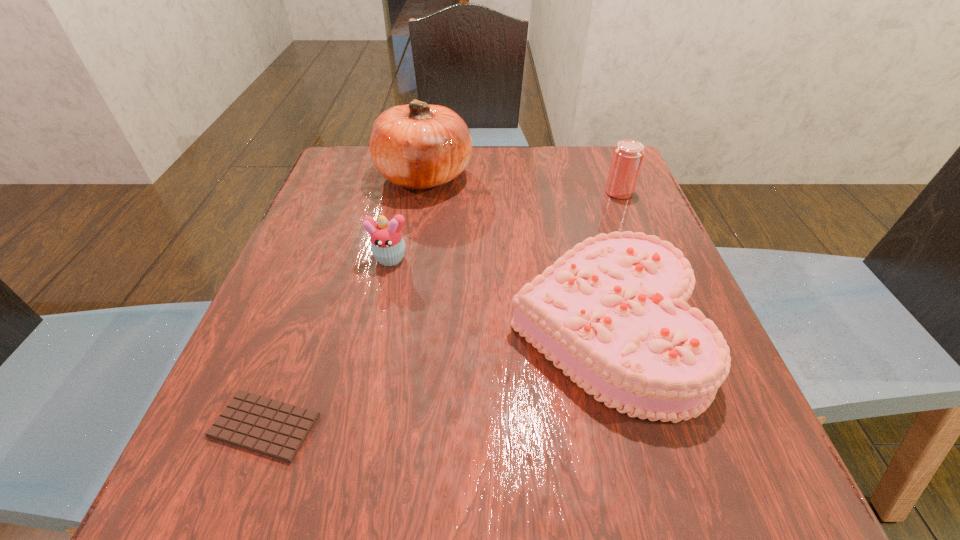
Find the location of a particular element. The width and height of the screenshot is (960, 540). pumpkin that is at the far edge is located at coordinates (418, 145).

Find the location of a particular element. This screenshot has height=540, width=960. beer can positioned at the far edge is located at coordinates (628, 154).

Locate an element on the screen. The width and height of the screenshot is (960, 540). object located at the near edge is located at coordinates (273, 428).

Where is `pumpkin situated at the left edge`? This screenshot has height=540, width=960. pumpkin situated at the left edge is located at coordinates (418, 145).

Find the location of a particular element. cupcake located at the left edge is located at coordinates (387, 243).

This screenshot has height=540, width=960. What are the coordinates of `chocolate bar situated at the left edge` in the screenshot? It's located at (273, 428).

Image resolution: width=960 pixels, height=540 pixels. Identify the location of beer can that is at the right edge. (628, 154).

This screenshot has width=960, height=540. In order to click on cake that is positioned at the right edge in this screenshot , I will do `click(611, 313)`.

Locate an element on the screen. object that is at the far left corner is located at coordinates (418, 145).

Where is `object that is at the near left corner`? Image resolution: width=960 pixels, height=540 pixels. object that is at the near left corner is located at coordinates (273, 428).